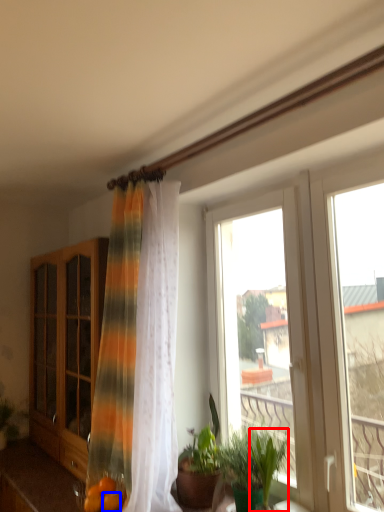
Question: Which point is closer to the camera, plant (highlighted by a red box) or citrus fruit (highlighted by a blue box)?

Choices:
 (A) plant
 (B) citrus fruit

Answer: (A)